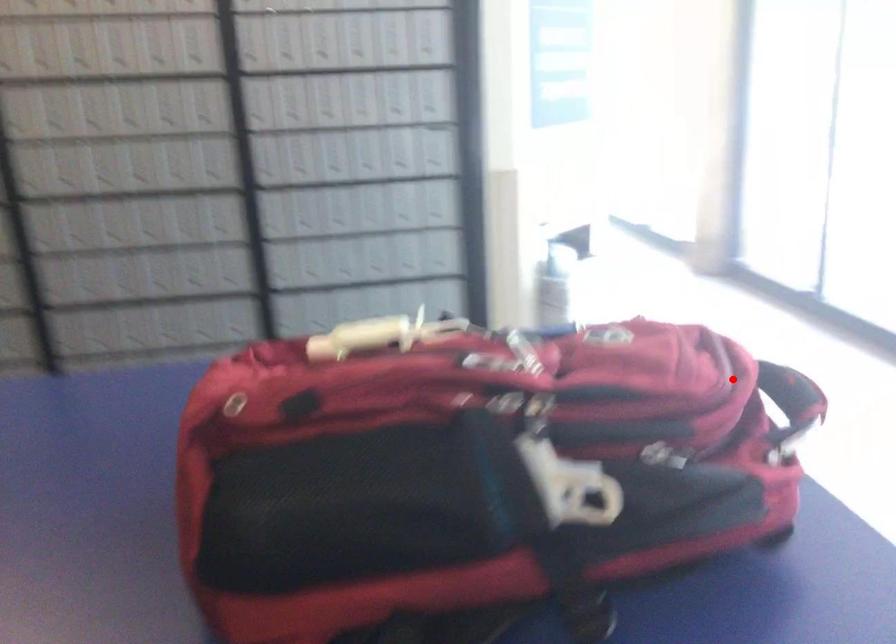
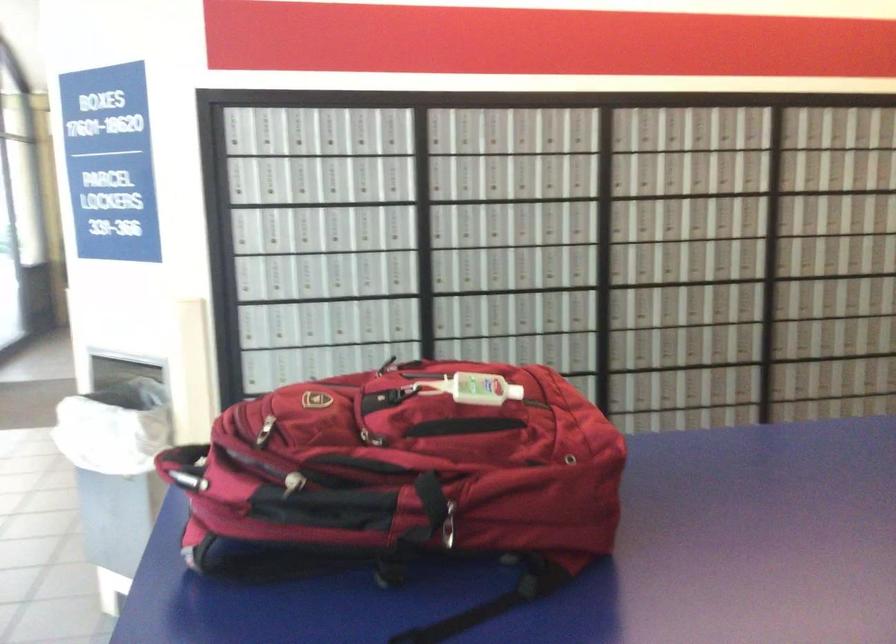
Find the pixel in the second image that matches the highlighted location in the first image.

(185, 466)